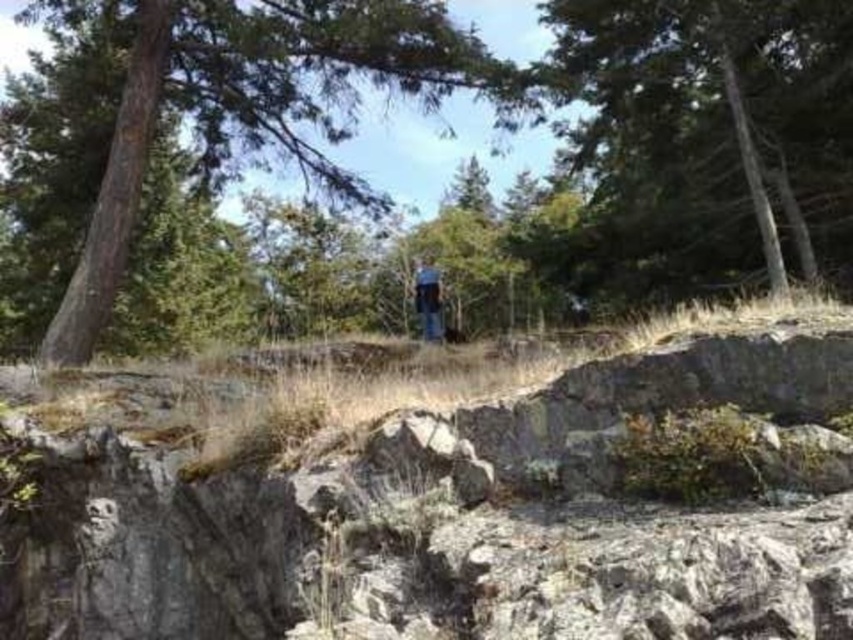
Describe the element at coordinates (701, 140) in the screenshot. I see `green textured tree at upper center` at that location.

Which is behind, point (621, 124) or point (418, 269)?

The point (418, 269) is more distant.

Where is `green textured tree at upper center`? Image resolution: width=853 pixels, height=640 pixels. green textured tree at upper center is located at coordinates (701, 140).

Is the position of brown wood tree at upper center more distant than that of blue jeans at center?

No, brown wood tree at upper center is closer to the viewer.

Can you confirm if brown wood tree at upper center is bigger than blue jeans at center?

No.

The image size is (853, 640). Describe the element at coordinates (260, 104) in the screenshot. I see `brown wood tree at upper center` at that location.

Identify the location of brown wood tree at upper center. (260, 104).

Who is higher up, green textured tree at upper center or brown wood tree at upper center?

Positioned higher is brown wood tree at upper center.

Is green textured tree at upper center above brown wood tree at upper center?

No, green textured tree at upper center is not above brown wood tree at upper center.

Who is more distant from viewer, (631, 273) or (337, 170)?

Point (631, 273)

I want to click on green textured tree at upper center, so click(701, 140).